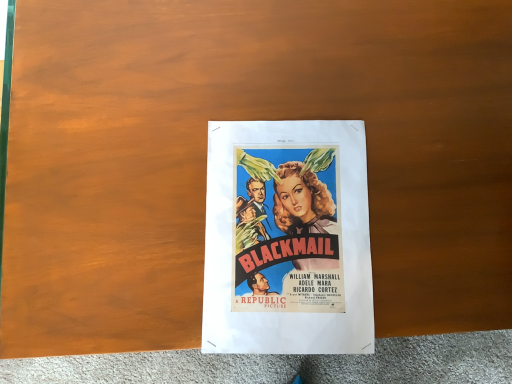
Find the location of `vacant location behind matte paper poster at center`. vacant location behind matte paper poster at center is located at coordinates (304, 66).